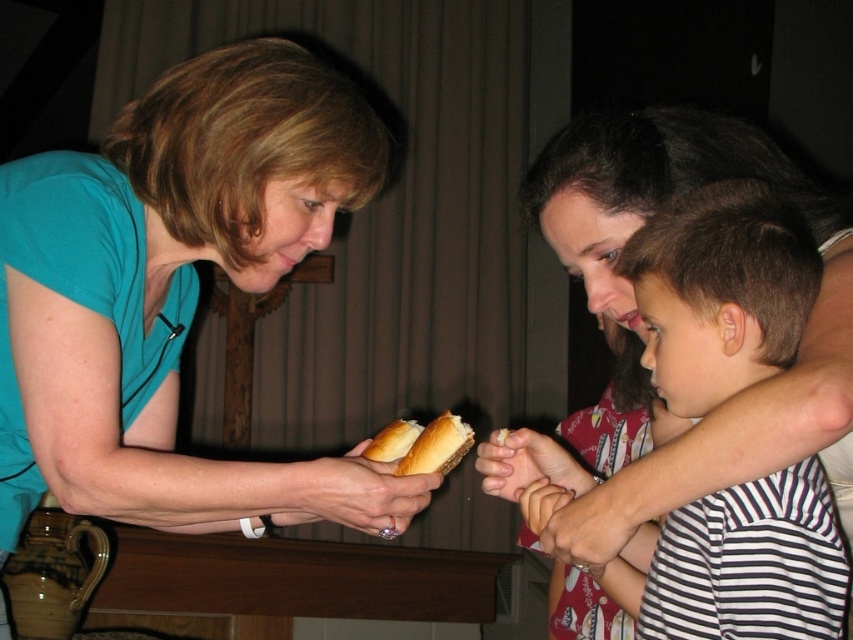
You are a photographer standing at a certain position. You want to take a portrait of the person wearing the matte teal shirt at left. The camera requires a minimum distance of 40 inches to focus properly. Do you think you can take a clear photo from your current position?

The matte teal shirt at left and camera are 35.36 inches apart from each other. Since the required minimum distance is 40 inches, the camera is too close to take a clear photo.

You are standing in front of the scene and want to touch both points. Which point should you reach for first, point at (112, 349) or point at (763, 538)?

You should reach for point at (112, 349) first because it is closer to you than point at (763, 538).